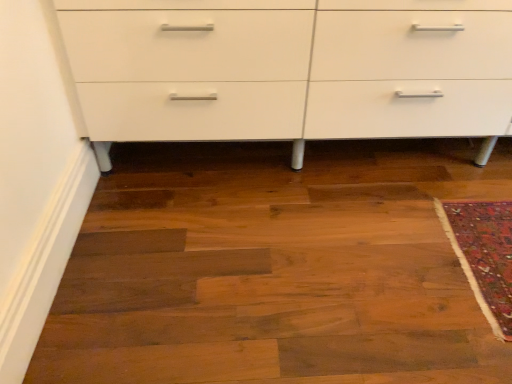
Question: Should I look upward or downward to see white glossy chest of drawers at center?

Choices:
 (A) up
 (B) down

Answer: (A)